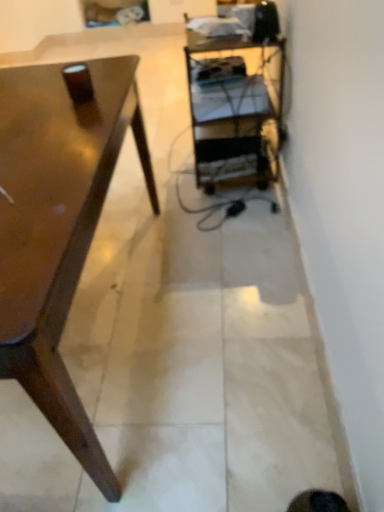
Where is `vacant space positioned to the left of metallic silver shelf at center`? vacant space positioned to the left of metallic silver shelf at center is located at coordinates (154, 170).